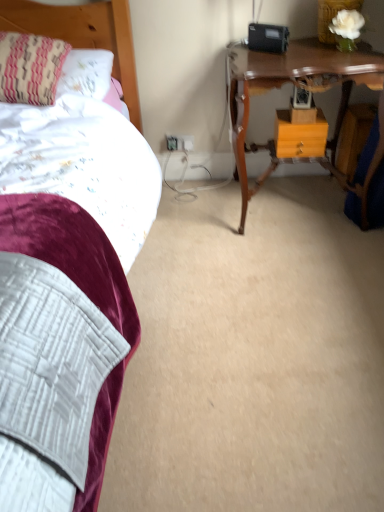
Question: Are orange matte drawer at center and wooden table at upper right located far from each other?

Choices:
 (A) no
 (B) yes

Answer: (A)

Question: Is orange matte drawer at center in contact with wooden table at upper right?

Choices:
 (A) yes
 (B) no

Answer: (B)

Question: Is wooden table at upper right completely or partially inside orange matte drawer at center?

Choices:
 (A) yes
 (B) no

Answer: (B)

Question: Does orange matte drawer at center appear on the right side of wooden table at upper right?

Choices:
 (A) no
 (B) yes

Answer: (B)

Question: Can you confirm if orange matte drawer at center is shorter than wooden table at upper right?

Choices:
 (A) no
 (B) yes

Answer: (B)

Question: Does orange matte drawer at center have a greater width compared to wooden table at upper right?

Choices:
 (A) yes
 (B) no

Answer: (B)

Question: From the image's perspective, does wooden headboard at upper left appear higher than striped fabric pillow at upper left?

Choices:
 (A) yes
 (B) no

Answer: (A)

Question: Is wooden headboard at upper left not within striped fabric pillow at upper left?

Choices:
 (A) yes
 (B) no

Answer: (B)

Question: Is wooden headboard at upper left placed right next to striped fabric pillow at upper left?

Choices:
 (A) no
 (B) yes

Answer: (A)

Question: Is striped fabric pillow at upper left at the back of wooden headboard at upper left?

Choices:
 (A) no
 (B) yes

Answer: (B)

Question: Is wooden headboard at upper left not near striped fabric pillow at upper left?

Choices:
 (A) yes
 (B) no

Answer: (B)

Question: Is wooden headboard at upper left thinner than striped fabric pillow at upper left?

Choices:
 (A) no
 (B) yes

Answer: (B)

Question: Does wooden table at upper right lie behind striped fabric pillow at upper left?

Choices:
 (A) yes
 (B) no

Answer: (A)